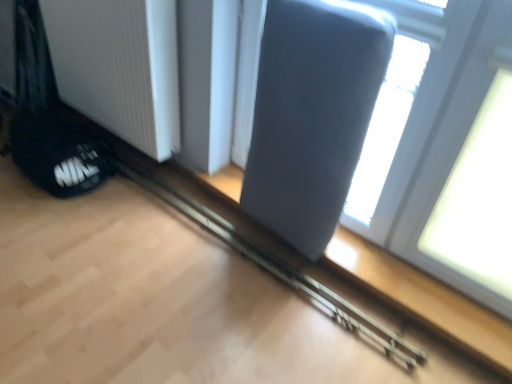
Question: Is metallic gray rail at center surrounding white ribbed radiator at lower left?

Choices:
 (A) yes
 (B) no

Answer: (B)

Question: Is metallic gray rail at center positioned with its back to white ribbed radiator at lower left?

Choices:
 (A) no
 (B) yes

Answer: (A)

Question: Is metallic gray rail at center thinner than white ribbed radiator at lower left?

Choices:
 (A) no
 (B) yes

Answer: (A)

Question: Does metallic gray rail at center have a smaller size compared to white ribbed radiator at lower left?

Choices:
 (A) yes
 (B) no

Answer: (A)

Question: From the image's perspective, is metallic gray rail at center on white ribbed radiator at lower left?

Choices:
 (A) no
 (B) yes

Answer: (A)

Question: Is matte gray cushion at upper right taller or shorter than white ribbed radiator at lower left?

Choices:
 (A) tall
 (B) short

Answer: (A)

Question: From the image's perspective, relative to white ribbed radiator at lower left, is matte gray cushion at upper right above or below?

Choices:
 (A) above
 (B) below

Answer: (B)

Question: Which is correct: matte gray cushion at upper right is inside white ribbed radiator at lower left, or outside of it?

Choices:
 (A) inside
 (B) outside

Answer: (B)

Question: Considering the positions of matte gray cushion at upper right and white ribbed radiator at lower left in the image, is matte gray cushion at upper right wider or thinner than white ribbed radiator at lower left?

Choices:
 (A) thin
 (B) wide

Answer: (A)

Question: Considering the relative positions of black mesh shoe at lower left and matte gray cushion at upper right in the image provided, is black mesh shoe at lower left to the left or to the right of matte gray cushion at upper right?

Choices:
 (A) left
 (B) right

Answer: (A)

Question: Is black mesh shoe at lower left inside the boundaries of matte gray cushion at upper right, or outside?

Choices:
 (A) outside
 (B) inside

Answer: (A)

Question: Is black mesh shoe at lower left wider or thinner than matte gray cushion at upper right?

Choices:
 (A) thin
 (B) wide

Answer: (B)

Question: Relative to matte gray cushion at upper right, is black mesh shoe at lower left in front or behind?

Choices:
 (A) front
 (B) behind

Answer: (B)

Question: In the image, is black mesh shoe at lower left positioned in front of or behind suede gray swivel chair at upper right?

Choices:
 (A) front
 (B) behind

Answer: (B)

Question: In terms of width, does black mesh shoe at lower left look wider or thinner when compared to suede gray swivel chair at upper right?

Choices:
 (A) wide
 (B) thin

Answer: (A)